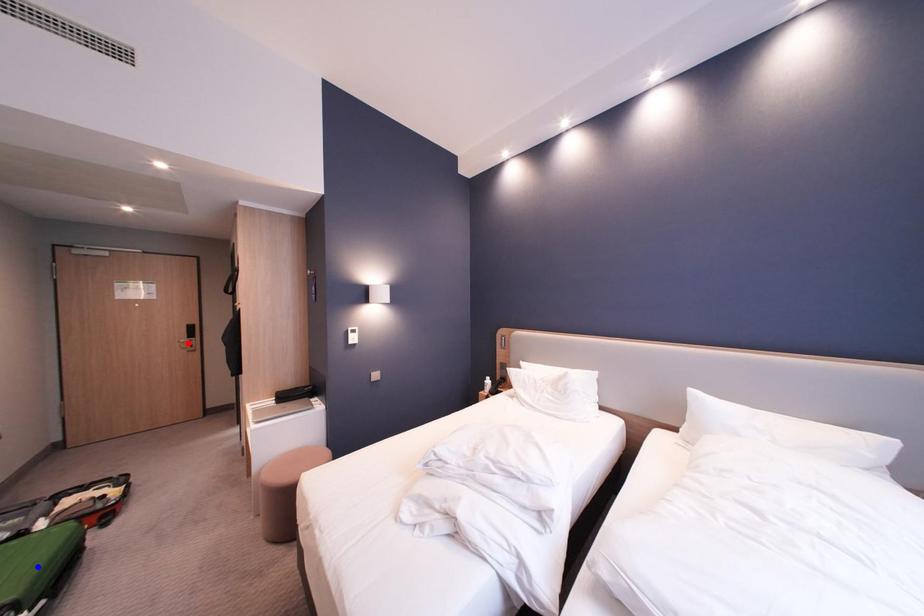
Question: In the image, two points are highlighted. Which point is nearer to the camera? Reply with the corresponding letter.

Choices:
 (A) blue point
 (B) red point

Answer: (A)